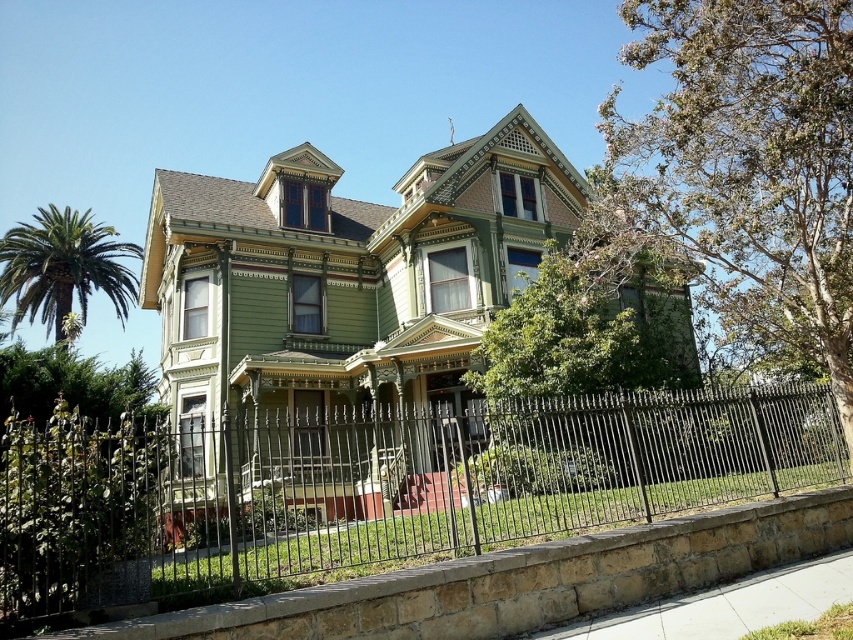
Can you confirm if black wrought iron fence at center is thinner than green leafy palm tree at left?

Correct, black wrought iron fence at center's width is less than green leafy palm tree at left's.

Can you confirm if black wrought iron fence at center is smaller than green leafy palm tree at left?

Indeed, black wrought iron fence at center has a smaller size compared to green leafy palm tree at left.

The image size is (853, 640). I want to click on black wrought iron fence at center, so click(x=374, y=486).

You are a GUI agent. You are given a task and a screenshot of the screen. Output one action in this format:
    pyautogui.click(x=<x>, y=<y>)
    Task: Click on the black wrought iron fence at center
    
    Given the screenshot: What is the action you would take?
    pyautogui.click(x=374, y=486)